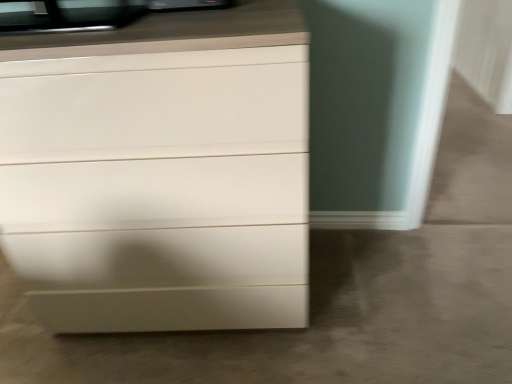
Locate an element on the screen. The width and height of the screenshot is (512, 384). matte white chest of drawers at lower left is located at coordinates (160, 173).

Image resolution: width=512 pixels, height=384 pixels. What do you see at coordinates (160, 173) in the screenshot? I see `matte white chest of drawers at lower left` at bounding box center [160, 173].

This screenshot has width=512, height=384. Find the location of `matte white chest of drawers at lower left`. matte white chest of drawers at lower left is located at coordinates (160, 173).